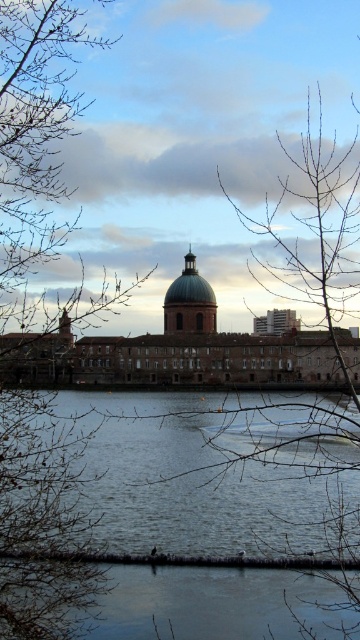
You are an artist sketching the riverside scene. You want to draw the bare branches at left and the smooth water at center accurately. Which object should you sketch first to maintain proper spatial relationships?

You should sketch the bare branches at left first because they are behind the smooth water at center, so drawing them first allows you to layer the smooth water at center over them appropriately.

You are an artist planning to sketch this riverside scene. You want to ensure the smooth water at center and the bare branches at left are proportionally accurate. Which object should you draw wider in your sketch?

The smooth water at center should be drawn wider than the bare branches at left because its width surpasses the branches.

You are an artist trying to paint the scene. You need to decide whether to paint the smooth water at center first or the bare branches at left first. Based on their positions, which should you paint first to ensure proper layering?

The smooth water at center is positioned under the bare branches at left, so you should paint the smooth water at center first, then paint the bare branches at left on top to maintain the correct layering.